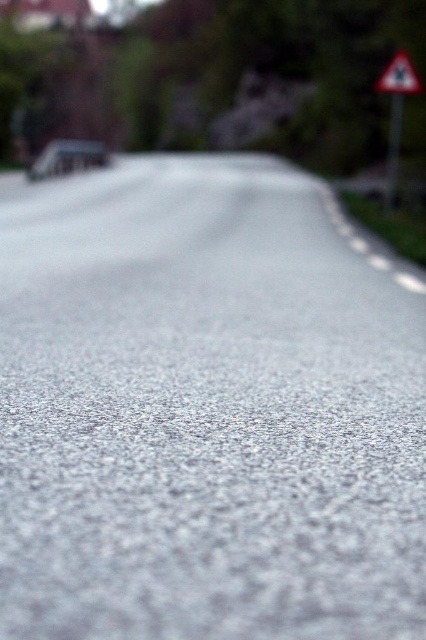
Question: Is white triangular sign at upper right wider than white reflective triangle at upper right?

Choices:
 (A) yes
 (B) no

Answer: (A)

Question: Does white triangular sign at upper right lie behind white reflective triangle at upper right?

Choices:
 (A) no
 (B) yes

Answer: (B)

Question: Which point is farther to the camera?

Choices:
 (A) (408, 68)
 (B) (403, 76)

Answer: (B)

Question: Which point is farther from the camera taking this photo?

Choices:
 (A) (397, 64)
 (B) (393, 74)

Answer: (B)

Question: Is white triangular sign at upper right to the left of white reflective triangle at upper right from the viewer's perspective?

Choices:
 (A) yes
 (B) no

Answer: (B)